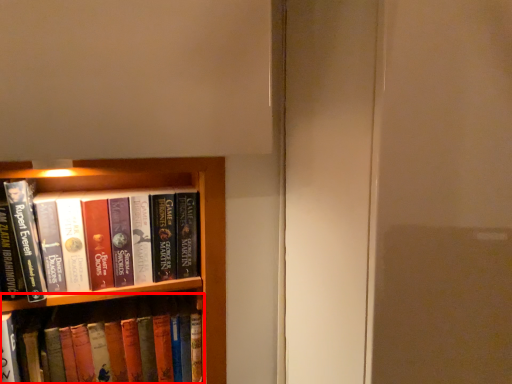
Question: From the image's perspective, what is the correct spatial positioning of book (annotated by the red box) in reference to book?

Choices:
 (A) above
 (B) below

Answer: (B)